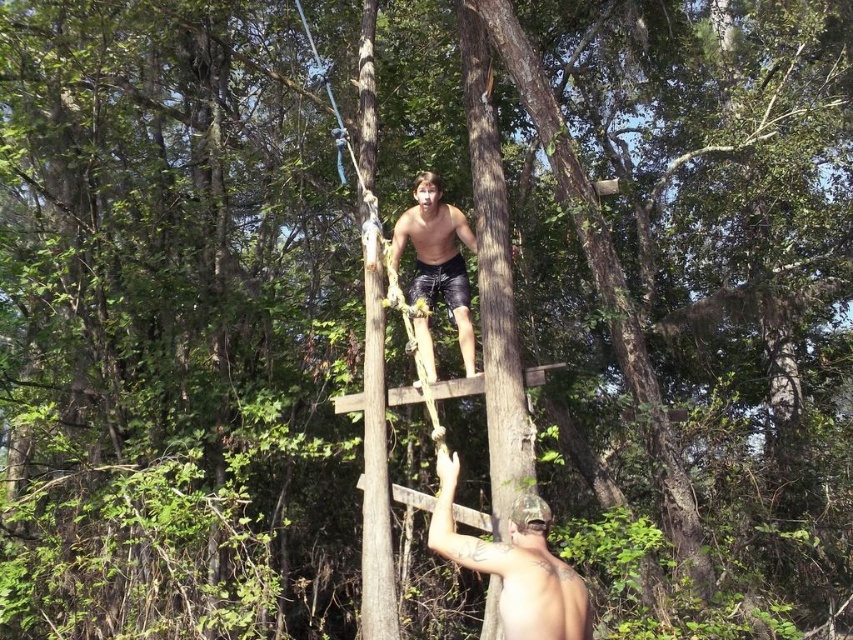
Who is positioned more to the left, shiny silver helmet at lower right or shiny black shorts at center?

Positioned to the left is shiny black shorts at center.

Is the position of shiny silver helmet at lower right more distant than that of shiny black shorts at center?

No, it is not.

Which is behind, point (444, 477) or point (412, 285)?

The point (412, 285) is more distant.

Where is `shiny silver helmet at lower right`? shiny silver helmet at lower right is located at coordinates (515, 564).

Who is shorter, brown rough wood pole at center or shiny black shorts at center?

With less height is shiny black shorts at center.

Does brown rough wood pole at center appear under shiny black shorts at center?

No.

Between point (373, 164) and point (437, 250), which one is positioned behind?

The point (373, 164) is more distant.

Find the location of a particular element. brown rough wood pole at center is located at coordinates (375, 454).

Can you confirm if brown rough wood pole at center is bigger than shiny silver helmet at lower right?

Indeed, brown rough wood pole at center has a larger size compared to shiny silver helmet at lower right.

Can you confirm if brown rough wood pole at center is positioned above shiny silver helmet at lower right?

Yes.

At what (x,y) coordinates should I click in order to perform the action: click on brown rough wood pole at center. Please return your answer as a coordinate pair (x, y). This screenshot has width=853, height=640. Looking at the image, I should click on (375, 454).